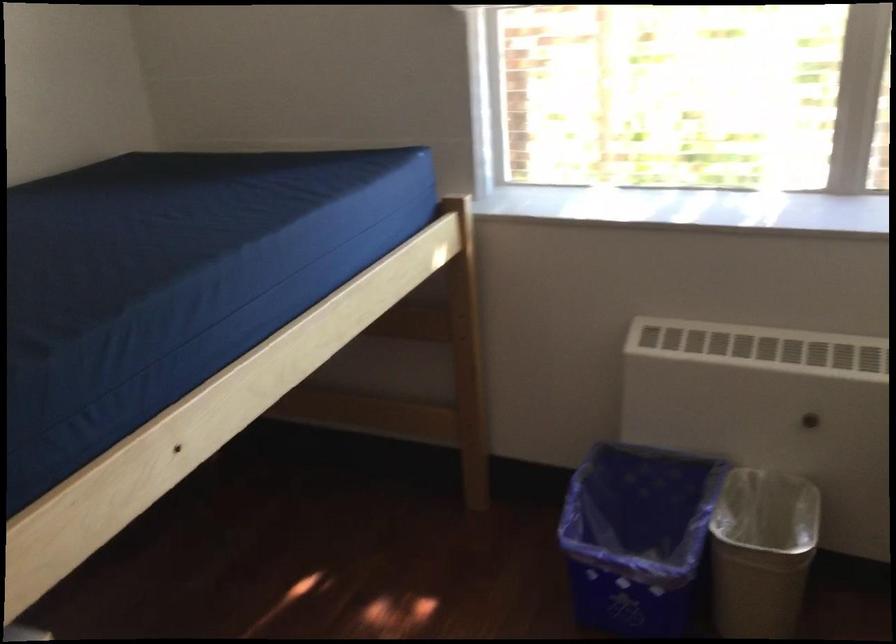
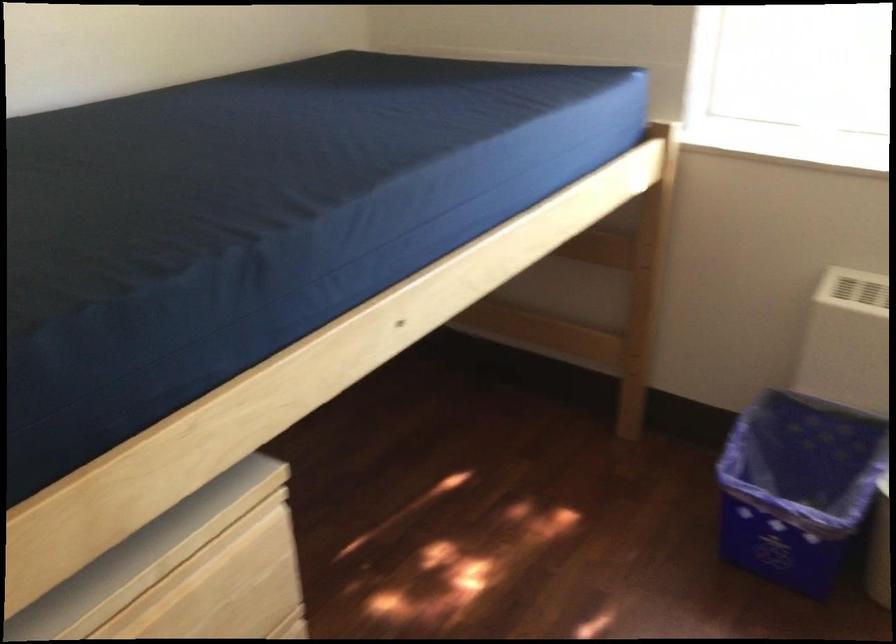
Question: The images are taken continuously from a first-person perspective. In which direction are you moving?

Choices:
 (A) Left
 (B) Right
 (C) Forward
 (D) Backward

Answer: (A)